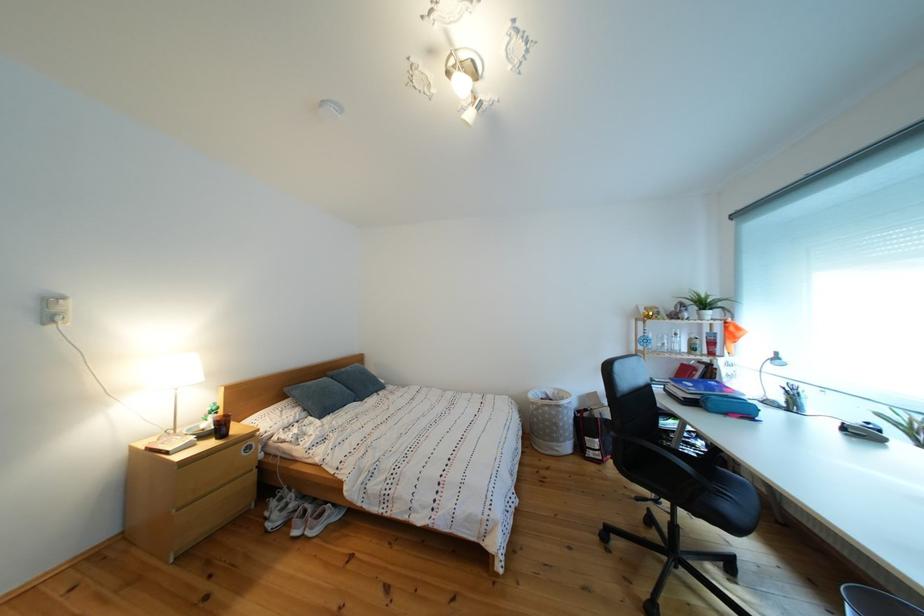
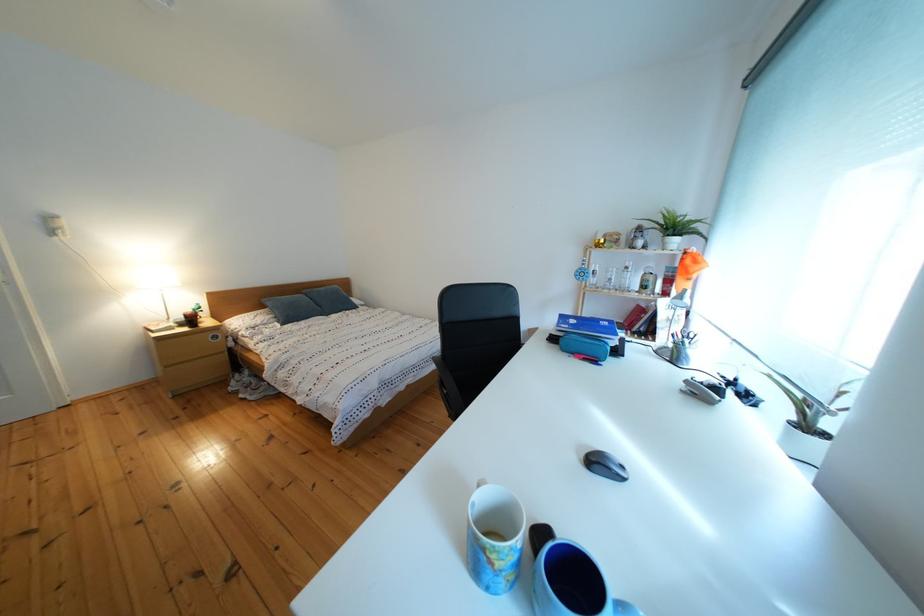
Where in the second image is the point corresponding to (744,334) from the first image?

(699, 267)